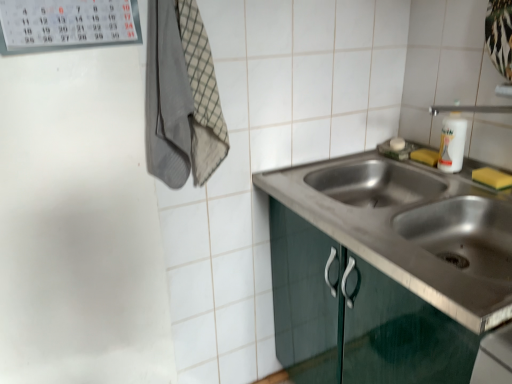
Describe the element at coordinates (452, 140) in the screenshot. I see `white glossy bottle at upper right` at that location.

Describe the element at coordinates (181, 96) in the screenshot. I see `gray cotton towel at upper left` at that location.

You are a GUI agent. You are given a task and a screenshot of the screen. Output one action in this format:
    pyautogui.click(x=<x>, y=<y>)
    Task: Click on the stainless steel sink at center
    Image resolution: width=512 pixels, height=384 pixels.
    Given the screenshot: What is the action you would take?
    pyautogui.click(x=412, y=228)

Which object is closer to the camera, yellow sponge at sink right, placed as the first soap when sorted from left to right, or stainless steel sink at lower right?

stainless steel sink at lower right is closer to the camera.

Considering the positions of objects yellow sponge at sink right, positioned as the second soap in front-to-back order, and stainless steel sink at lower right in the image provided, who is more to the right, yellow sponge at sink right, positioned as the second soap in front-to-back order, or stainless steel sink at lower right?

yellow sponge at sink right, positioned as the second soap in front-to-back order, is more to the right.

Considering the sizes of objects yellow sponge at sink right, which appears as the first soap when viewed from the back, and stainless steel sink at lower right in the image provided, who is smaller, yellow sponge at sink right, which appears as the first soap when viewed from the back, or stainless steel sink at lower right?

yellow sponge at sink right, which appears as the first soap when viewed from the back.

Between yellow sponge at sink right, arranged as the first soap when viewed from the top, and stainless steel sink at lower right, which one has less height?

With less height is yellow sponge at sink right, arranged as the first soap when viewed from the top.

In order to click on bottle that appears above the yellow sponge at right, which is the second soap in top-to-bottom order (from a real-world perspective) in this screenshot , I will do `click(452, 140)`.

Is white glossy bottle at upper right surrounded by yellow sponge at right, which ranks as the second soap in back-to-front order?

No, white glossy bottle at upper right is located outside of yellow sponge at right, which ranks as the second soap in back-to-front order.

From the image's perspective, is yellow sponge at right, which is the 2th soap in left-to-right order, under white glossy bottle at upper right?

Yes, from the image's perspective, yellow sponge at right, which is the 2th soap in left-to-right order, is beneath white glossy bottle at upper right.

Which is more to the right, yellow sponge at right, which is the second soap in top-to-bottom order, or white glossy bottle at upper right?

Positioned to the right is yellow sponge at right, which is the second soap in top-to-bottom order.

Is white glossy bottle at upper right positioned with its back to stainless steel sink at lower right?

That's not correct — white glossy bottle at upper right is not looking away from stainless steel sink at lower right.

Is white glossy bottle at upper right completely or partially outside of stainless steel sink at lower right?

Indeed, white glossy bottle at upper right is completely outside stainless steel sink at lower right.

Considering the relative sizes of white glossy bottle at upper right and stainless steel sink at lower right in the image provided, is white glossy bottle at upper right bigger than stainless steel sink at lower right?

Actually, white glossy bottle at upper right might be smaller than stainless steel sink at lower right.

Is stainless steel sink at lower right not inside yellow sponge at right, arranged as the first soap when ordered from the bottom?

Yes, stainless steel sink at lower right is not within yellow sponge at right, arranged as the first soap when ordered from the bottom.

Between stainless steel sink at lower right and yellow sponge at right, which is the 1th soap in front-to-back order, which one has larger size?

stainless steel sink at lower right.

Is stainless steel sink at lower right oriented towards yellow sponge at right, which is the 2th soap in left-to-right order?

No, stainless steel sink at lower right is not aimed at yellow sponge at right, which is the 2th soap in left-to-right order.

Is point (399, 335) positioned before point (472, 176)?

Yes.

Does stainless steel sink at center have a lesser height compared to yellow sponge at sink right, arranged as the 2th soap when ordered from the bottom?

Incorrect, the height of stainless steel sink at center does not fall short of that of yellow sponge at sink right, arranged as the 2th soap when ordered from the bottom.

Is point (389, 218) positioned behind point (416, 154)?

No, (389, 218) is closer to viewer.

Considering the relative sizes of stainless steel sink at center and yellow sponge at sink right, placed as the first soap when sorted from left to right, in the image provided, is stainless steel sink at center bigger than yellow sponge at sink right, placed as the first soap when sorted from left to right,?

Yes, stainless steel sink at center is bigger than yellow sponge at sink right, placed as the first soap when sorted from left to right.

From a real-world perspective, between stainless steel sink at center and yellow sponge at sink right, arranged as the first soap when viewed from the top, who is vertically higher?

In real-world perspective, yellow sponge at sink right, arranged as the first soap when viewed from the top, is above.

From a real-world perspective, is stainless steel sink at center positioned above or below stainless steel sink at lower right?

In terms of real-world spatial position, stainless steel sink at center is above stainless steel sink at lower right.

Is stainless steel sink at center oriented towards stainless steel sink at lower right?

No, stainless steel sink at center is not turned towards stainless steel sink at lower right.

Between stainless steel sink at center and stainless steel sink at lower right, which one is positioned behind?

stainless steel sink at lower right is further from the camera.

Does point (463, 261) appear closer or farther from the camera than point (453, 136)?

Point (463, 261).

Is stainless steel sink at center taller than white glossy bottle at upper right?

Incorrect, the height of stainless steel sink at center is not larger of that of white glossy bottle at upper right.

How much distance is there between stainless steel sink at center and white glossy bottle at upper right?

The distance of stainless steel sink at center from white glossy bottle at upper right is 11.69 inches.

Between stainless steel sink at center and white glossy bottle at upper right, which one is positioned in front?

stainless steel sink at center.

At what (x,y) coordinates should I click in order to perform the action: click on the 2nd soap behind when counting from the stainless steel sink at lower right. Please return your answer as a coordinate pair (x, y). Image resolution: width=512 pixels, height=384 pixels. Looking at the image, I should click on (425, 156).

Where is `bottle above the yellow sponge at right, which is the 2th soap in left-to-right order (from a real-world perspective)`? bottle above the yellow sponge at right, which is the 2th soap in left-to-right order (from a real-world perspective) is located at coordinates (452, 140).

Based on their spatial positions, is gray cotton towel at upper left or white glossy bottle at upper right closer to stainless steel sink at lower right?

Based on the image, gray cotton towel at upper left appears to be nearer to stainless steel sink at lower right.

From the picture: From the image, which object appears to be farther from gray cotton towel at upper left, yellow sponge at right, arranged as the first soap when viewed from the right, or stainless steel sink at lower right?

yellow sponge at right, arranged as the first soap when viewed from the right.

Looking at the image, which one is located further to yellow sponge at sink right, the second soap positioned from the right, white glossy bottle at upper right or stainless steel sink at center?

stainless steel sink at center lies further to yellow sponge at sink right, the second soap positioned from the right, than the other object.

Consider the image. From the image, which object appears to be farther from stainless steel sink at lower right, yellow sponge at right, arranged as the first soap when ordered from the bottom, or stainless steel sink at center?

yellow sponge at right, arranged as the first soap when ordered from the bottom, is positioned further to the anchor stainless steel sink at lower right.

Considering their positions, is stainless steel sink at lower right positioned further to yellow sponge at sink right, the second soap positioned from the right, than gray cotton towel at upper left?

gray cotton towel at upper left is positioned further to the anchor yellow sponge at sink right, the second soap positioned from the right.

Estimate the real-world distances between objects in this image. Which object is closer to yellow sponge at sink right, arranged as the first soap when viewed from the top, stainless steel sink at center or stainless steel sink at lower right?

Among the two, stainless steel sink at center is located nearer to yellow sponge at sink right, arranged as the first soap when viewed from the top.

From the image, which object appears to be nearer to stainless steel sink at lower right, yellow sponge at right, arranged as the first soap when ordered from the bottom, or gray cotton towel at upper left?

gray cotton towel at upper left.

Considering their positions, is gray cotton towel at upper left positioned further to white glossy bottle at upper right than yellow sponge at right, which is the 2th soap in left-to-right order?

Among the two, gray cotton towel at upper left is located further to white glossy bottle at upper right.

Image resolution: width=512 pixels, height=384 pixels. In order to click on bottle located between stainless steel sink at center and yellow sponge at sink right, arranged as the 2th soap when ordered from the bottom, in the depth direction in this screenshot , I will do `click(452, 140)`.

Image resolution: width=512 pixels, height=384 pixels. Find the location of `cabinetry situated between gray cotton towel at upper left and white glossy bottle at upper right from left to right`. cabinetry situated between gray cotton towel at upper left and white glossy bottle at upper right from left to right is located at coordinates (401, 335).

In order to click on sink between gray cotton towel at upper left and yellow sponge at sink right, positioned as the second soap in front-to-back order in this screenshot , I will do `click(412, 228)`.

This screenshot has width=512, height=384. Find the location of `bottle located between gray cotton towel at upper left and yellow sponge at right, which is the 2th soap in left-to-right order, in the left-right direction`. bottle located between gray cotton towel at upper left and yellow sponge at right, which is the 2th soap in left-to-right order, in the left-right direction is located at coordinates (452, 140).